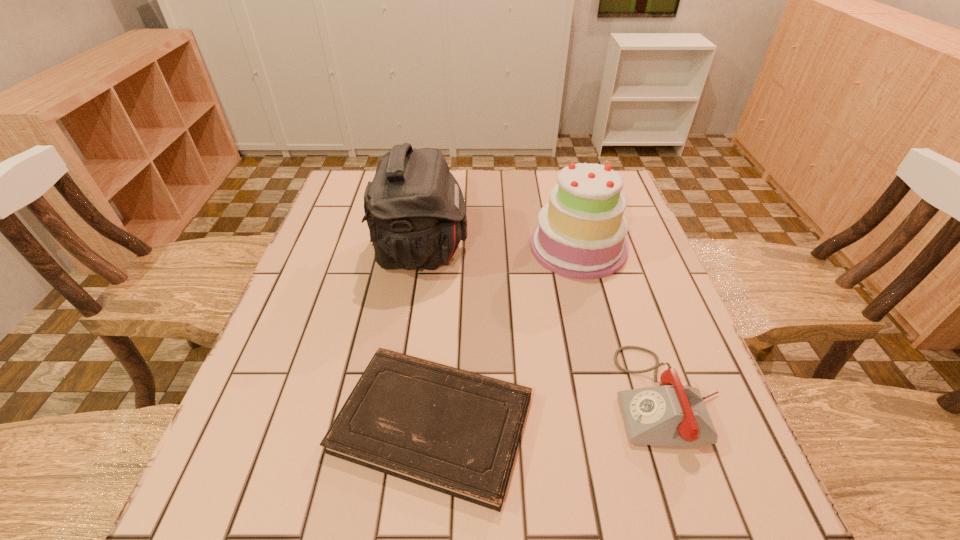
You are a GUI agent. You are given a task and a screenshot of the screen. Output one action in this format:
    pyautogui.click(x=<x>, y=<y>)
    Task: Click on the free space between the third tallest object and the shortest object
    
    Given the screenshot: What is the action you would take?
    pyautogui.click(x=550, y=409)

Identify the location of vacant region between the telephone and the shortest object. This screenshot has height=540, width=960. (550, 409).

This screenshot has height=540, width=960. In order to click on free point between the third tallest object and the paperback book in this screenshot , I will do `click(550, 409)`.

You are a GUI agent. You are given a task and a screenshot of the screen. Output one action in this format:
    pyautogui.click(x=<x>, y=<y>)
    Task: Click on the free spot between the second tallest object and the paperback book
    This screenshot has width=960, height=540.
    Given the screenshot: What is the action you would take?
    pyautogui.click(x=506, y=335)

The height and width of the screenshot is (540, 960). What are the coordinates of `vacant point located between the second shortest object and the paperback book` in the screenshot? It's located at (550, 409).

Image resolution: width=960 pixels, height=540 pixels. Find the location of `free space between the tallest object and the cake`. free space between the tallest object and the cake is located at coordinates (499, 249).

Image resolution: width=960 pixels, height=540 pixels. I want to click on free space between the tallest object and the shortest object, so click(x=427, y=337).

You are a GUI agent. You are given a task and a screenshot of the screen. Output one action in this format:
    pyautogui.click(x=<x>, y=<y>)
    Task: Click on the free space between the telephone and the paperback book
    
    Given the screenshot: What is the action you would take?
    pyautogui.click(x=550, y=409)

Find the location of a particular element. the second closest object relative to the cake is located at coordinates (672, 414).

Image resolution: width=960 pixels, height=540 pixels. In order to click on the closest object to the tallest object in this screenshot , I will do `click(581, 233)`.